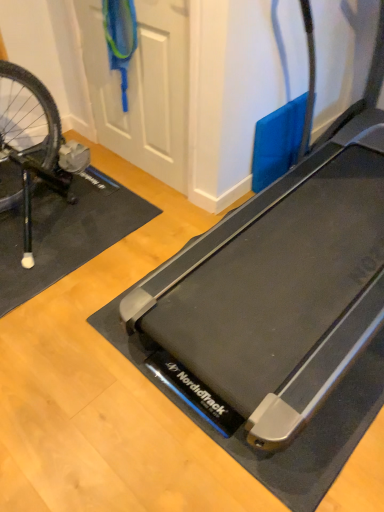
Locate an element on the screen. free point in front of white matte door at upper center is located at coordinates (132, 210).